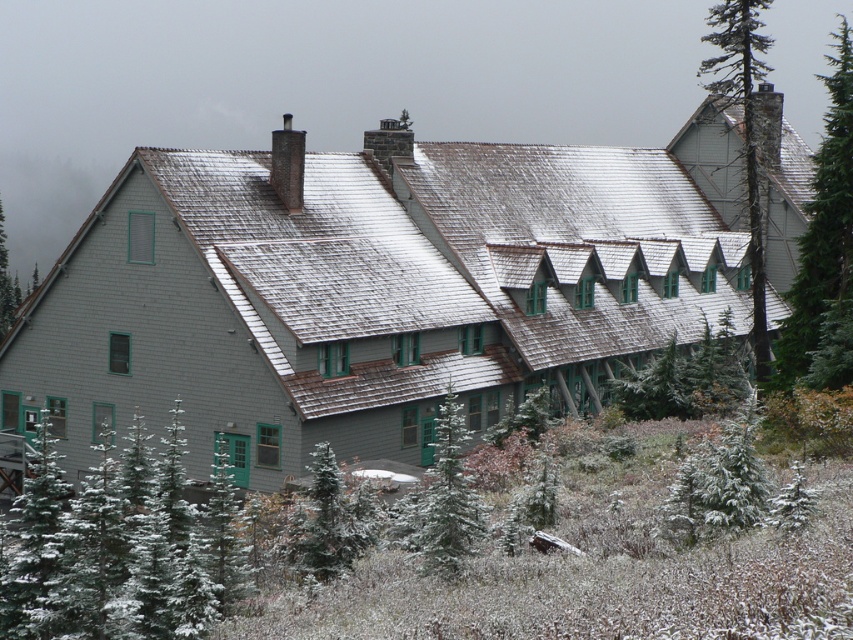
Question: Can you confirm if green textured pine tree at lower left is wider than smooth bark tree at upper right?

Choices:
 (A) yes
 (B) no

Answer: (B)

Question: Which object is the closest to the green wood tree at upper right?

Choices:
 (A) green textured pine tree at center
 (B) green textured pine tree at lower left

Answer: (B)

Question: Can you confirm if green textured pine tree at lower left is positioned above green textured pine tree at center?

Choices:
 (A) yes
 (B) no

Answer: (B)

Question: Which object is the farthest from the green wood tree at upper right?

Choices:
 (A) green textured pine tree at center
 (B) smooth bark tree at upper right

Answer: (A)

Question: Observing the image, what is the correct spatial positioning of green wood tree at upper right in reference to green textured pine tree at center?

Choices:
 (A) above
 (B) below

Answer: (A)

Question: Considering the real-world distances, which object is farthest from the green textured pine tree at lower left?

Choices:
 (A) smooth bark tree at upper right
 (B) green wood tree at upper right

Answer: (A)